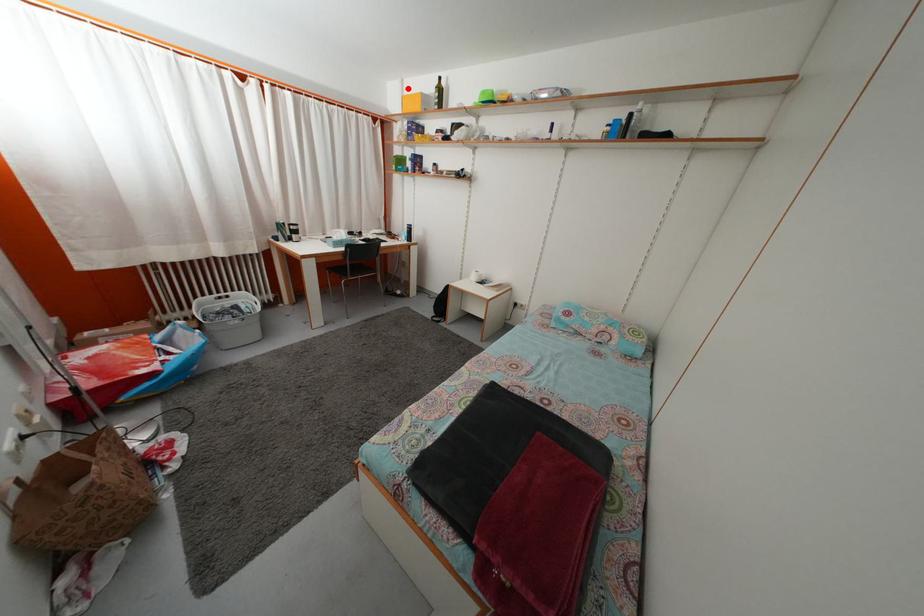
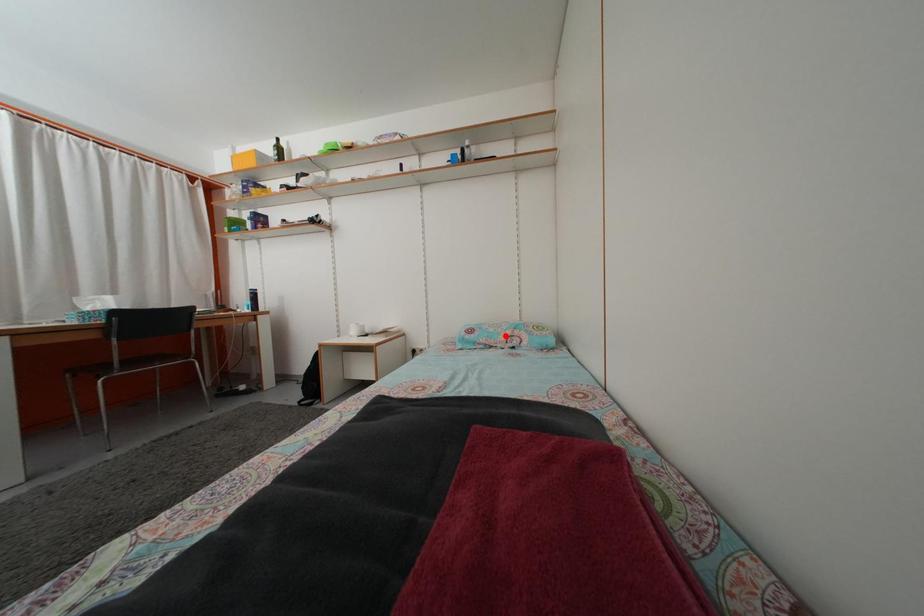
I am providing you with two images of the same scene from different viewpoints. A red point is marked on the first image and another point is marked on the second image. Are the points marked in image1 and image2 representing the same 3D position?

No